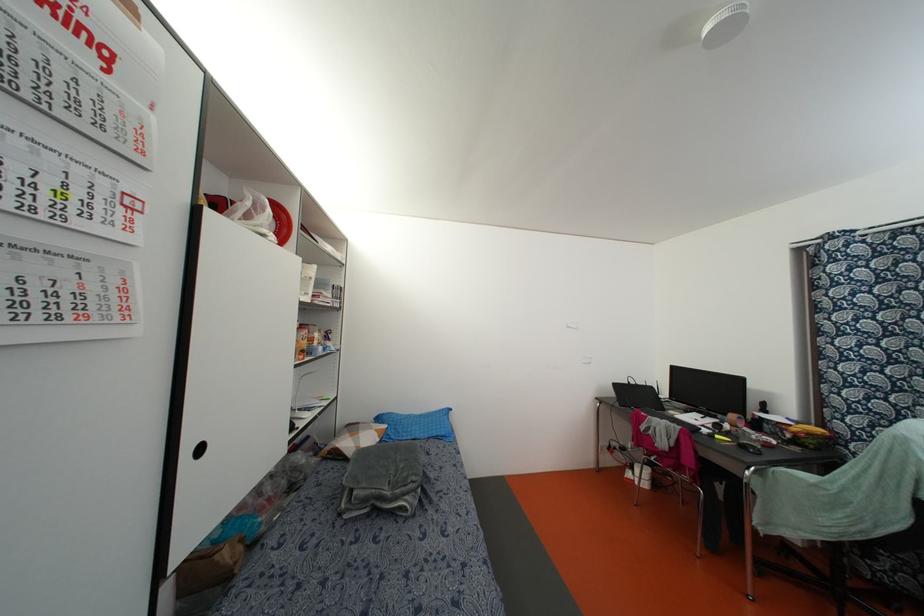
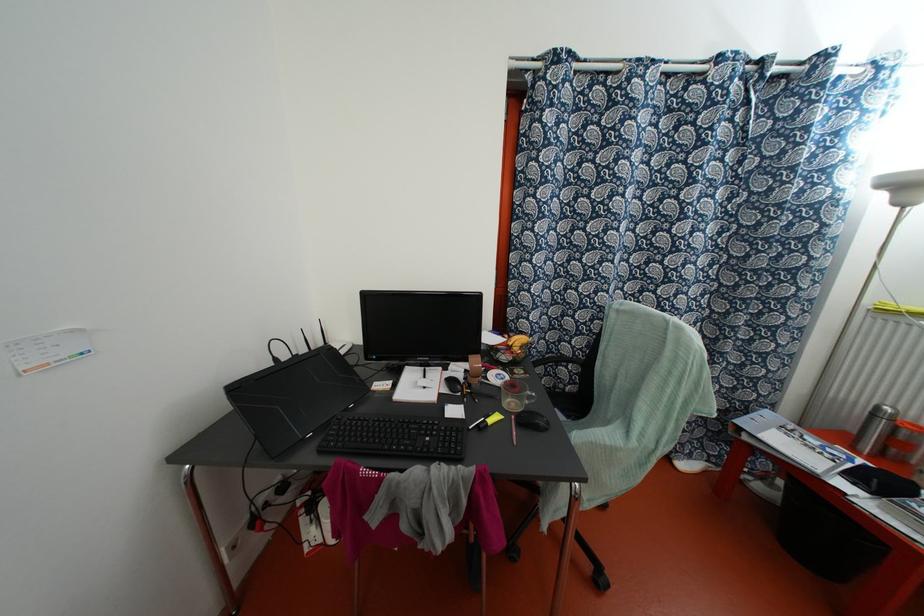
Locate, in the second image, the point that corresponds to (691,418) in the first image.

(418, 386)